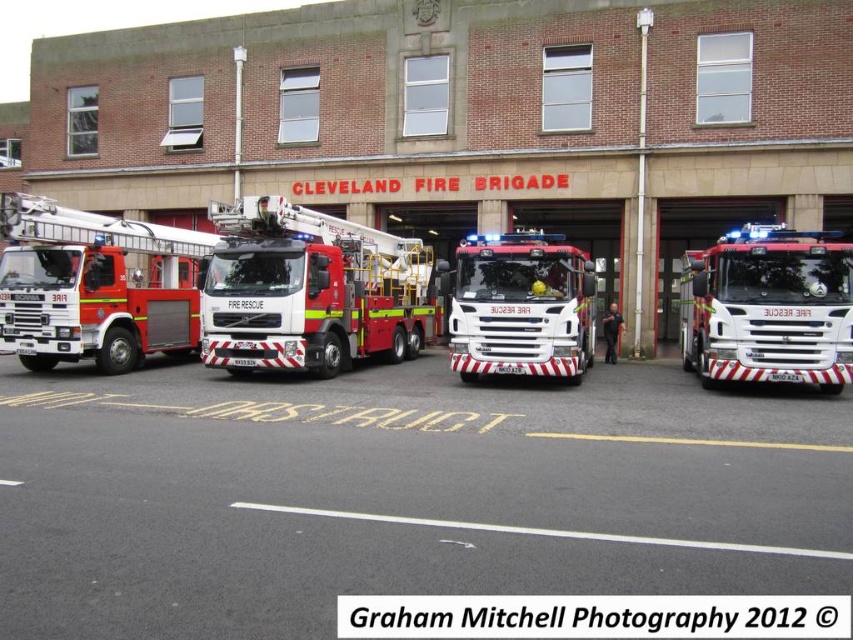
Is red matte fire truck at left shorter than red glossy fire truck at center?

Yes, red matte fire truck at left is shorter than red glossy fire truck at center.

Is the position of red matte fire truck at left more distant than that of red glossy fire truck at center?

Yes, red matte fire truck at left is behind red glossy fire truck at center.

You are a GUI agent. You are given a task and a screenshot of the screen. Output one action in this format:
    pyautogui.click(x=<x>, y=<y>)
    Task: Click on the red matte fire truck at left
    The height and width of the screenshot is (640, 853).
    Given the screenshot: What is the action you would take?
    pyautogui.click(x=91, y=285)

This screenshot has height=640, width=853. Find the location of `red matte fire truck at left`. red matte fire truck at left is located at coordinates (91, 285).

Can you confirm if red matte fire truck at center is positioned to the left of red matte fire truck at left?

No, red matte fire truck at center is not to the left of red matte fire truck at left.

Does red matte fire truck at center have a greater width compared to red matte fire truck at left?

Indeed, red matte fire truck at center has a greater width compared to red matte fire truck at left.

Which is in front, point (392, 356) or point (71, 298)?

Point (71, 298) is more forward.

At what (x,y) coordinates should I click in order to perform the action: click on red matte fire truck at center. Please return your answer as a coordinate pair (x, y). Looking at the image, I should click on (310, 291).

Between red matte fire truck at center and red glossy fire truck at center, which one is positioned higher?

Positioned higher is red glossy fire truck at center.

Is red matte fire truck at center to the right of red glossy fire truck at center from the viewer's perspective?

Incorrect, red matte fire truck at center is not on the right side of red glossy fire truck at center.

What do you see at coordinates (310, 291) in the screenshot? I see `red matte fire truck at center` at bounding box center [310, 291].

You are a GUI agent. You are given a task and a screenshot of the screen. Output one action in this format:
    pyautogui.click(x=<x>, y=<y>)
    Task: Click on the red matte fire truck at center
    
    Given the screenshot: What is the action you would take?
    pos(310,291)